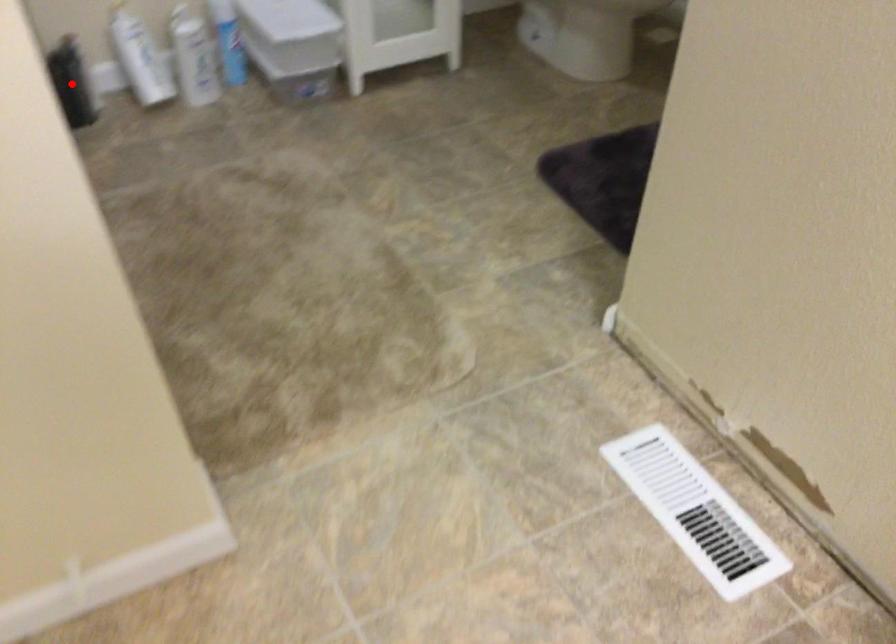
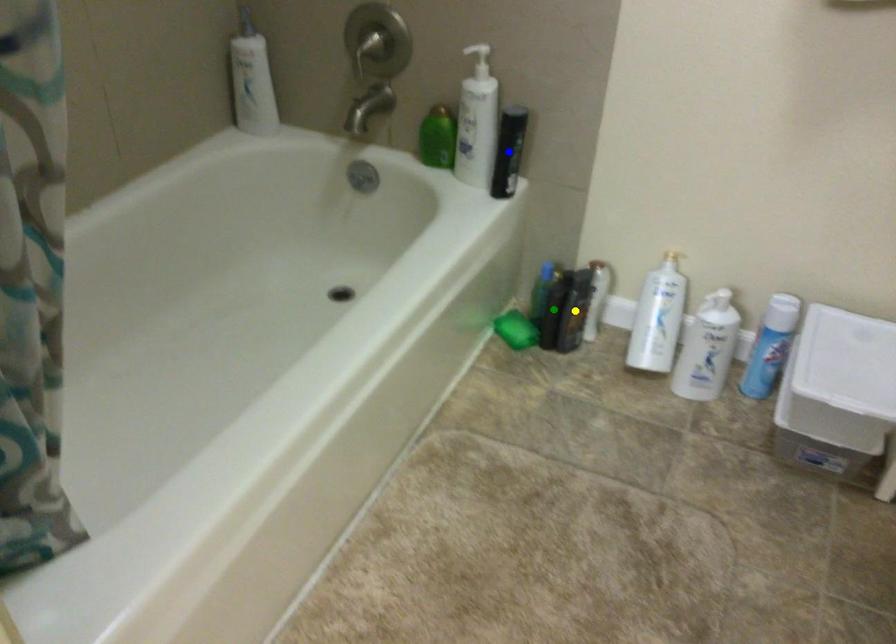
Question: I am providing you with two images of the same scene from different viewpoints. A red point is marked on the first image. You are given multiple points on the second image. Which spot in image 2 lines up with the point in image 1?

Choices:
 (A) green point
 (B) blue point
 (C) yellow point

Answer: (A)